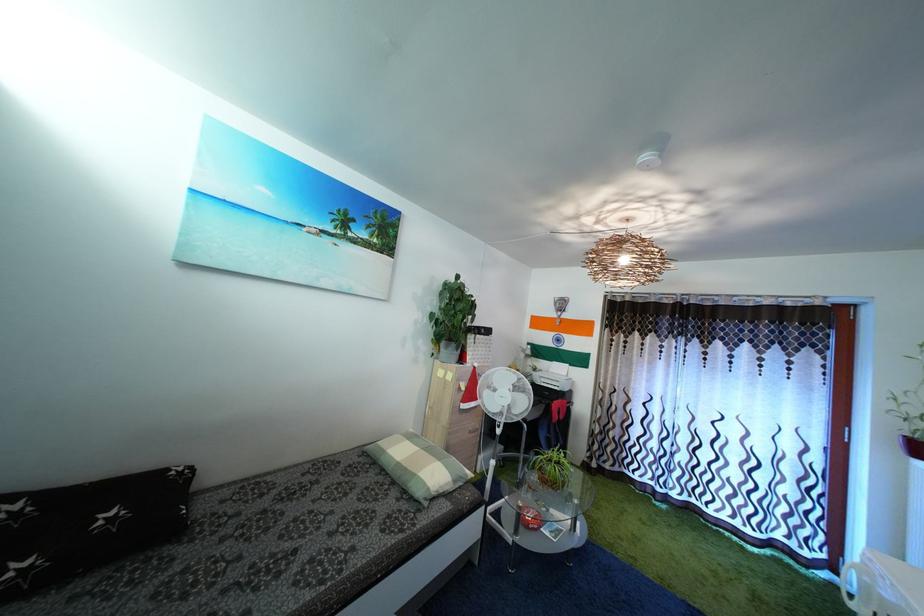
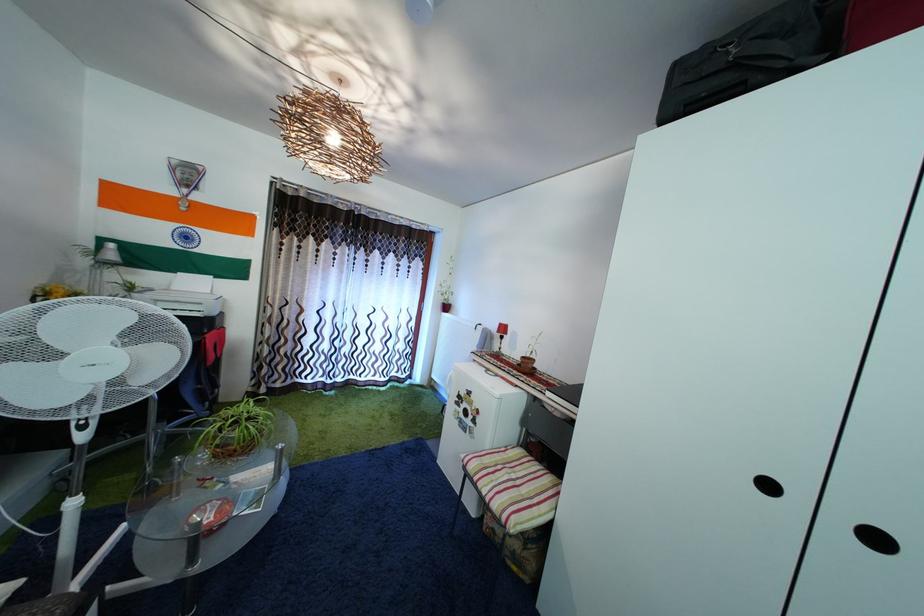
In the second image, find the point that corresponds to the point at 701,508 in the first image.

(359, 384)